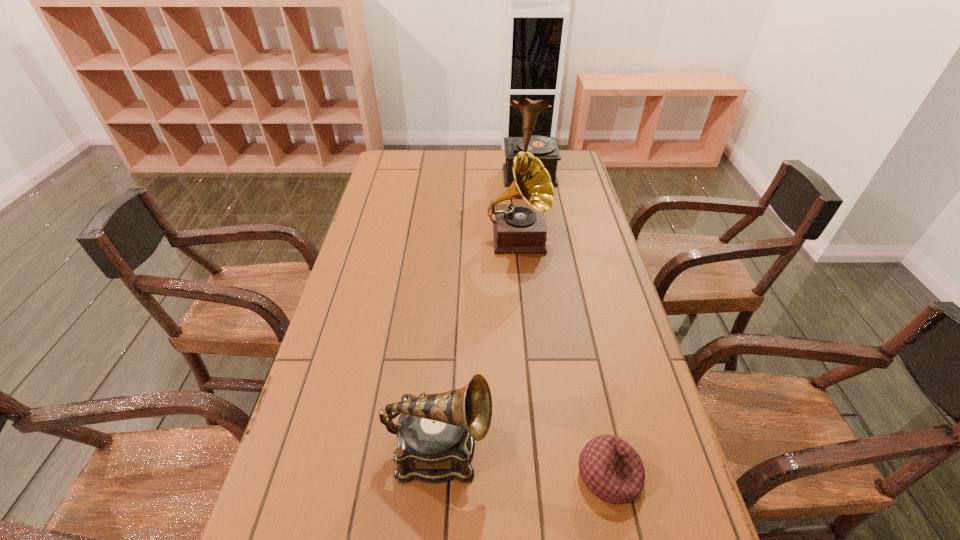
Find the location of a particular element. This screenshot has height=540, width=960. the farthest object is located at coordinates (544, 148).

At what (x,y) coordinates should I click in order to perform the action: click on the second nearest phonograph record. Please return your answer as a coordinate pair (x, y). The width and height of the screenshot is (960, 540). Looking at the image, I should click on (519, 228).

What are the coordinates of `the leftmost phonograph record` in the screenshot? It's located at (436, 433).

You are a GUI agent. You are given a task and a screenshot of the screen. Output one action in this format:
    pyautogui.click(x=<x>, y=<y>)
    Task: Click on the second shortest object
    This screenshot has height=540, width=960.
    Given the screenshot: What is the action you would take?
    pyautogui.click(x=436, y=433)

Where is `beanbag`? beanbag is located at coordinates (611, 468).

Image resolution: width=960 pixels, height=540 pixels. I want to click on vacant area situated at the horn opening of the farthest object, so coord(541,253).

Locate an element on the screen. free space located 0.370m from the horn of the second nearest phonograph record is located at coordinates pos(530,369).

At what (x,y) coordinates should I click in order to perform the action: click on vacant space situated on the horn of the shortest phonograph record. Please return your answer as a coordinate pair (x, y). The height and width of the screenshot is (540, 960). Looking at the image, I should click on (582, 449).

You are a GUI agent. You are given a task and a screenshot of the screen. Output one action in this format:
    pyautogui.click(x=<x>, y=<y>)
    Task: Click on the blank area located 0.120m on the left of the shortest object
    
    Given the screenshot: What is the action you would take?
    (x=516, y=475)

Identify the location of object that is at the far edge. (544, 148).